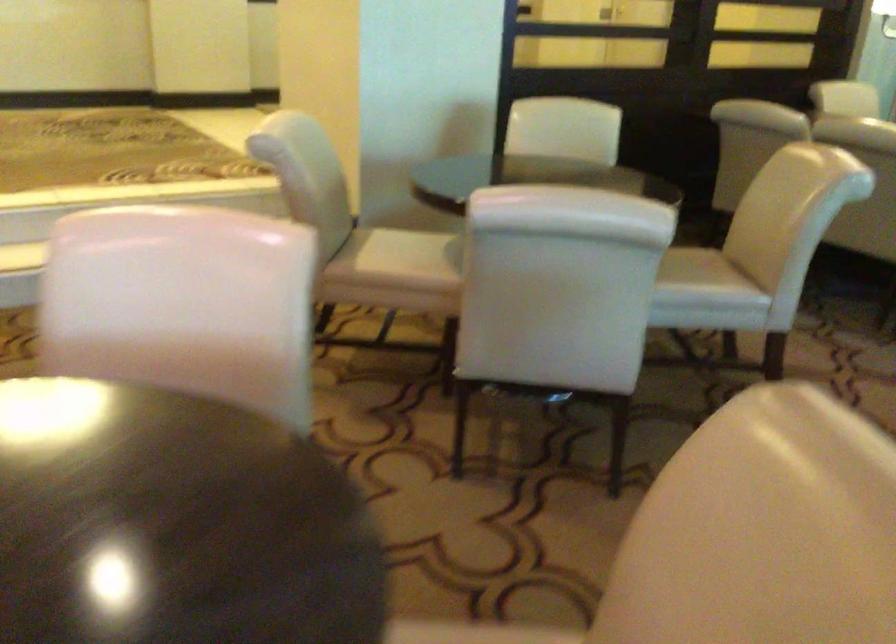
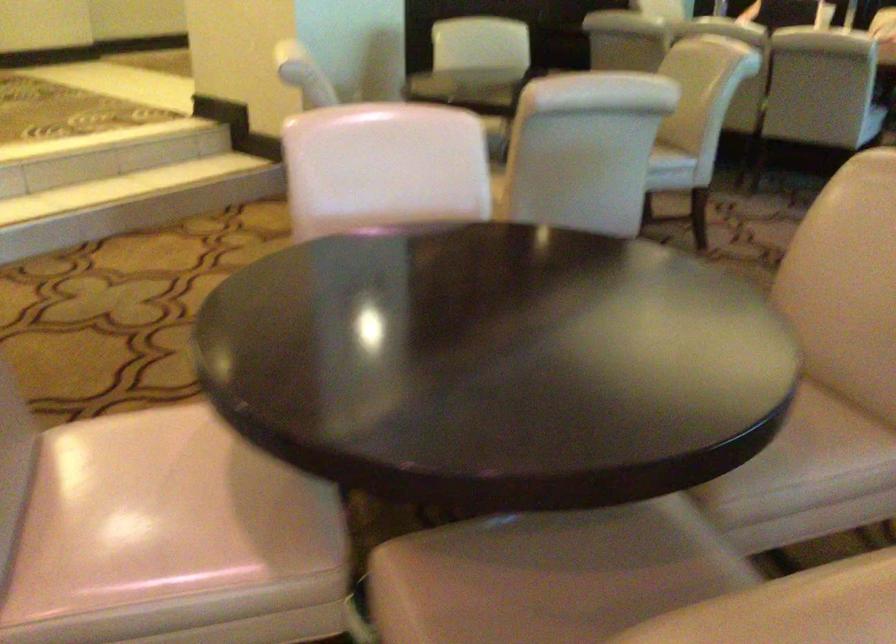
In the second image, find the point that corresponds to point (730, 299) in the first image.

(670, 163)